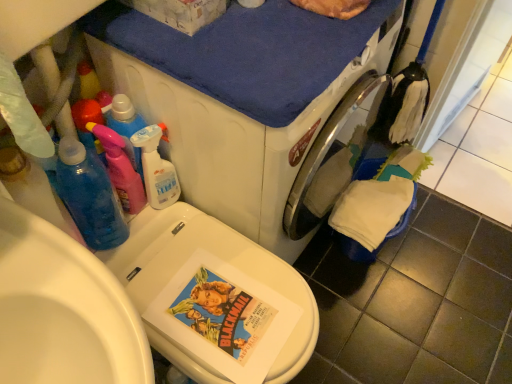
The height and width of the screenshot is (384, 512). What do you see at coordinates (63, 310) in the screenshot?
I see `white glossy sink at lower left` at bounding box center [63, 310].

Consider the image. What is the approximate height of white glossy sink at lower left?

7.60 inches.

At what (x,y) coordinates should I click in order to perform the action: click on white glossy sink at lower left. Please return your answer as a coordinate pair (x, y). Looking at the image, I should click on (63, 310).

Where is `white glossy sink at lower left`? This screenshot has width=512, height=384. white glossy sink at lower left is located at coordinates (63, 310).